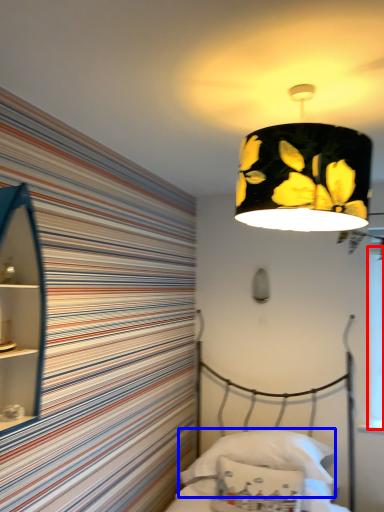
Question: Which of the following is the closest to the observer, window screen (highlighted by a red box) or pillow (highlighted by a blue box)?

Choices:
 (A) window screen
 (B) pillow

Answer: (B)